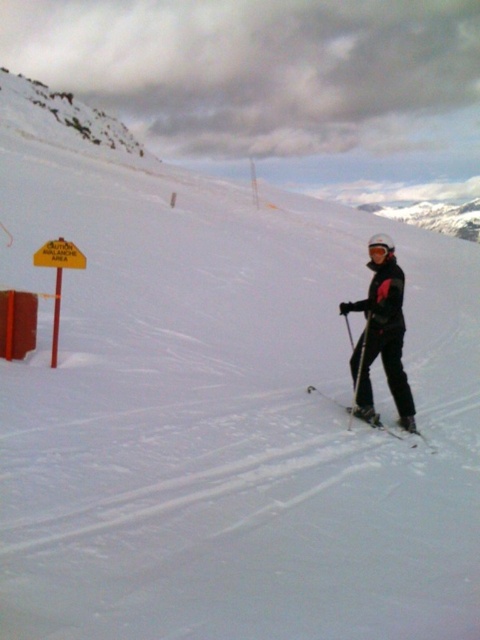
You are a skier wearing the white matte goggles at center and want to grab your matte black ski at center. Can you reach it without moving your feet?

The distance between the matte black ski at center and the white matte goggles at center is 2.21 meters. Since 2.21 meters is a considerable distance, you likely cannot reach the ski without moving your feet.